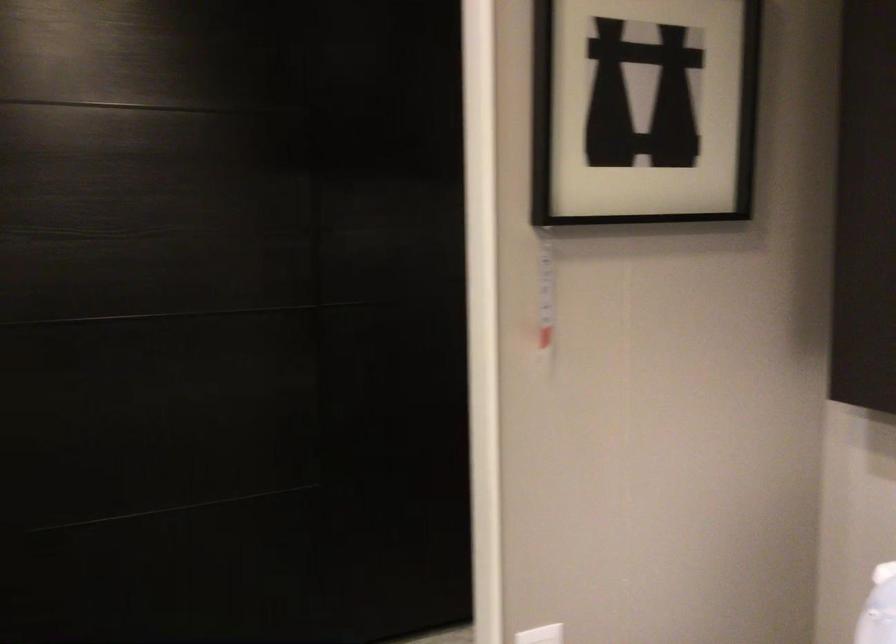
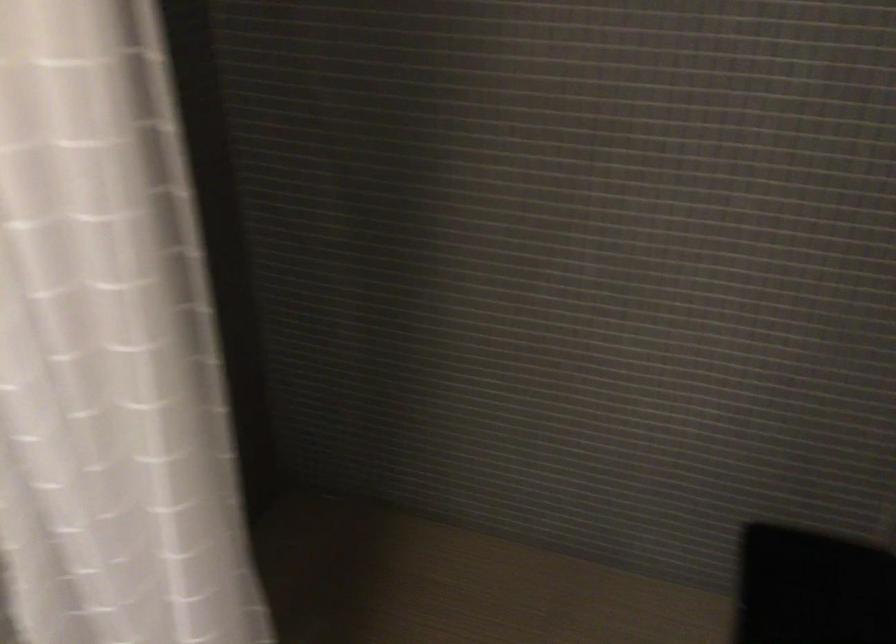
Looking at this image, based on the continuous images, in which direction is the camera rotating?

The camera's rotation is toward right-down.